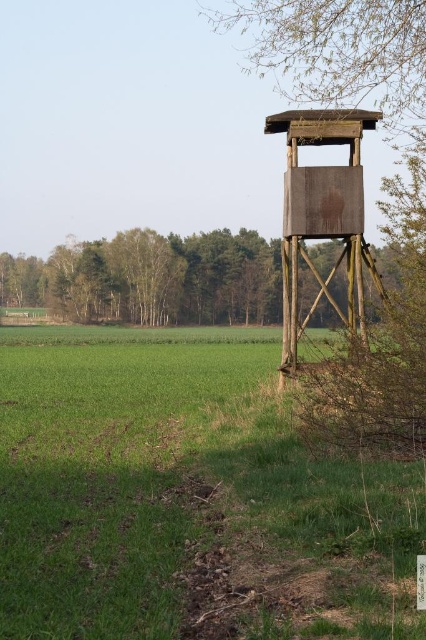
Question: From the image, what is the correct spatial relationship of green grass at lower left in relation to brown wooden tower at upper right?

Choices:
 (A) right
 (B) left

Answer: (B)

Question: Which is nearer to the rustic wooden tower at center?

Choices:
 (A) brown wooden tower at upper right
 (B) green grass at lower left

Answer: (B)

Question: Which object appears farthest from the camera in this image?

Choices:
 (A) brown wooden tower at upper right
 (B) rustic wooden tower at center
 (C) green grass at lower left

Answer: (A)

Question: Does brown wooden tower at upper right have a lesser width compared to rustic wooden tower at center?

Choices:
 (A) no
 (B) yes

Answer: (A)

Question: Is green grass at lower left bigger than rustic wooden tower at center?

Choices:
 (A) yes
 (B) no

Answer: (A)

Question: Which point is closer to the camera taking this photo?

Choices:
 (A) (322, 184)
 (B) (154, 305)

Answer: (A)